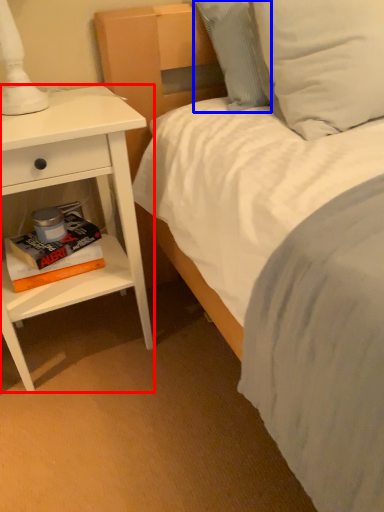
Question: Which object is further to the camera taking this photo, nightstand (highlighted by a red box) or pillow (highlighted by a blue box)?

Choices:
 (A) nightstand
 (B) pillow

Answer: (B)